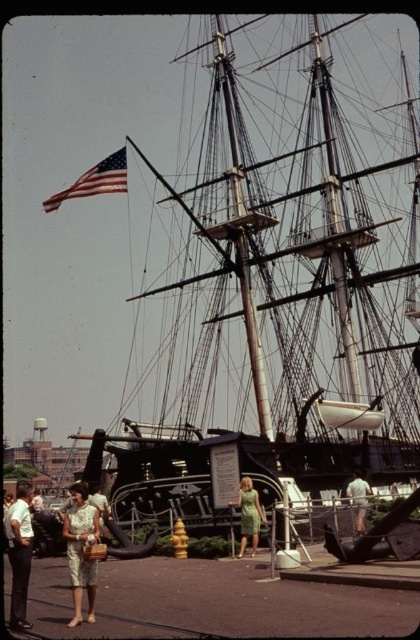
Is black polished wood ship at center thinner than light beige pants at lower left?

Incorrect, black polished wood ship at center's width is not less than light beige pants at lower left's.

Who is higher up, black polished wood ship at center or light beige pants at lower left?

black polished wood ship at center is above.

Find the location of a particular element. The width and height of the screenshot is (420, 640). black polished wood ship at center is located at coordinates (278, 273).

Between point (105, 157) and point (247, 518), which one is positioned behind?

Positioned behind is point (105, 157).

Which of these two, american flag at upper left or green fabric dress at center, stands taller?

Standing taller between the two is american flag at upper left.

Image resolution: width=420 pixels, height=640 pixels. Describe the element at coordinates (94, 180) in the screenshot. I see `american flag at upper left` at that location.

Locate an element on the screen. american flag at upper left is located at coordinates (94, 180).

Does american flag at upper left have a greater height compared to white fabric shirt at center?

Yes.

In the scene shown: Measure the distance between american flag at upper left and white fabric shirt at center.

The distance of american flag at upper left from white fabric shirt at center is 200.42 feet.

Is point (126, 172) positioned behind point (359, 515)?

That is True.

You are a GUI agent. You are given a task and a screenshot of the screen. Output one action in this format:
    pyautogui.click(x=<x>, y=<y>)
    Task: Click on the american flag at upper left
    
    Given the screenshot: What is the action you would take?
    pos(94,180)